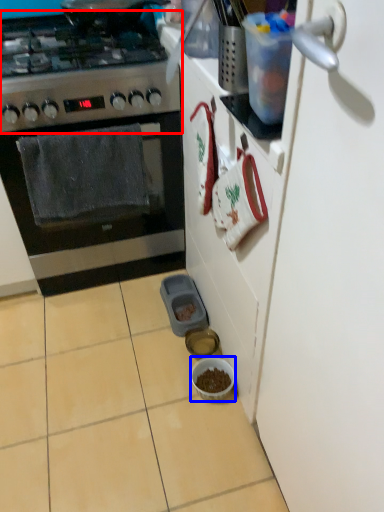
Question: Which object appears closest to the camera in this image, gas stove (highlighted by a red box) or bowl (highlighted by a blue box)?

Choices:
 (A) gas stove
 (B) bowl

Answer: (A)